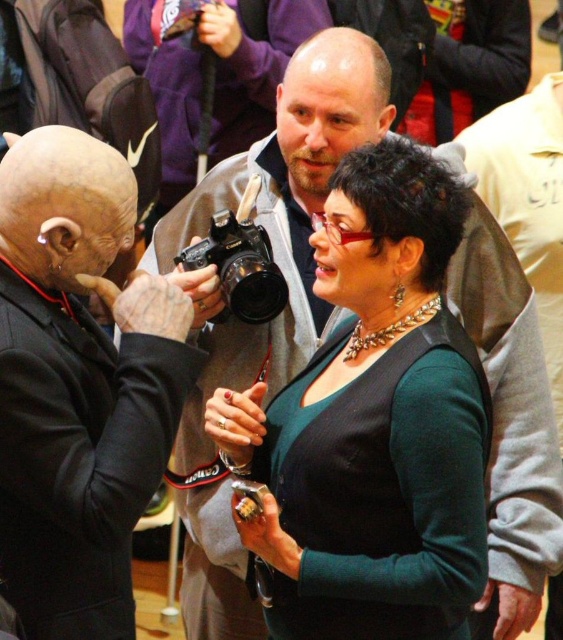
Question: Is the position of green matte dress at center more distant than that of black plastic camera at center?

Choices:
 (A) no
 (B) yes

Answer: (A)

Question: Is the position of green matte dress at center less distant than that of black plastic camera at center?

Choices:
 (A) no
 (B) yes

Answer: (B)

Question: Considering the real-world distances, which object is closest to the green matte dress at center?

Choices:
 (A) black plastic camera at center
 (B) black matte suit at left

Answer: (A)

Question: Can you confirm if black matte suit at left is wider than black plastic camera at center?

Choices:
 (A) yes
 (B) no

Answer: (A)

Question: Which of these objects is positioned closest to the black plastic camera at center?

Choices:
 (A) green matte dress at center
 (B) black matte suit at left

Answer: (B)

Question: Which point is closer to the camera taking this photo?

Choices:
 (A) (301, 605)
 (B) (92, 584)

Answer: (B)